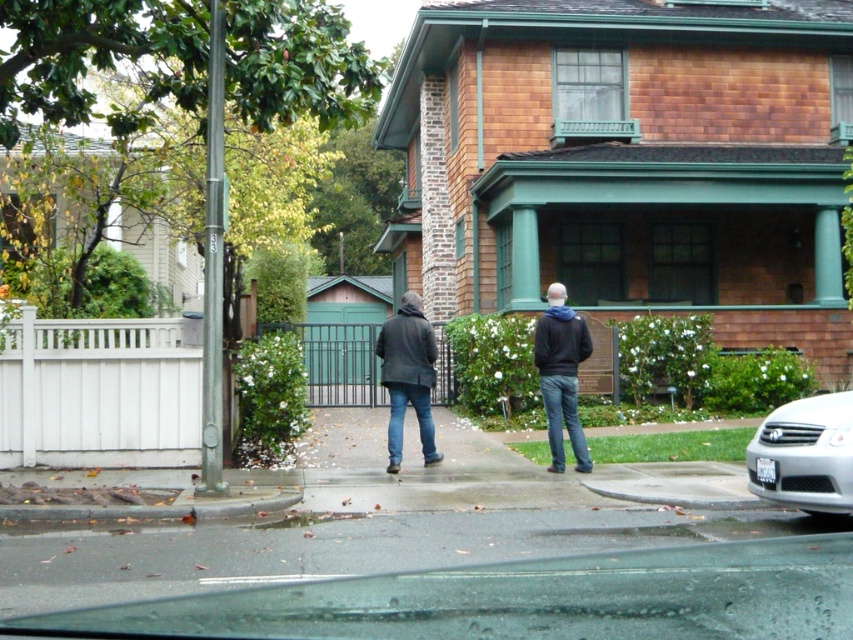
You are a delivery person trying to avoid getting your shoes wet. You see the smooth asphalt pavement at lower center and the black matte jacket at center. Which surface should you step on to keep your shoes dry?

The smooth asphalt pavement at lower center is not as tall as the black matte jacket at center, so stepping on the smooth asphalt pavement at lower center would keep your shoes dry as it is higher than the puddles.

You are standing on the sidewalk and see the smooth asphalt pavement at lower center and the dark gray jacket at center. Which object is closer to your right side?

The dark gray jacket at center is closer to your right side because the smooth asphalt pavement at lower center is to its left.